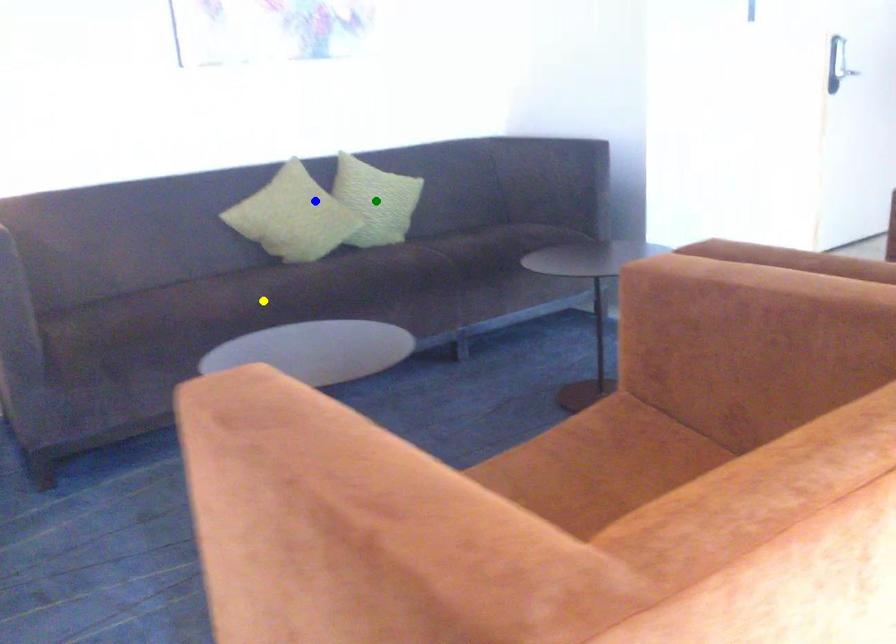
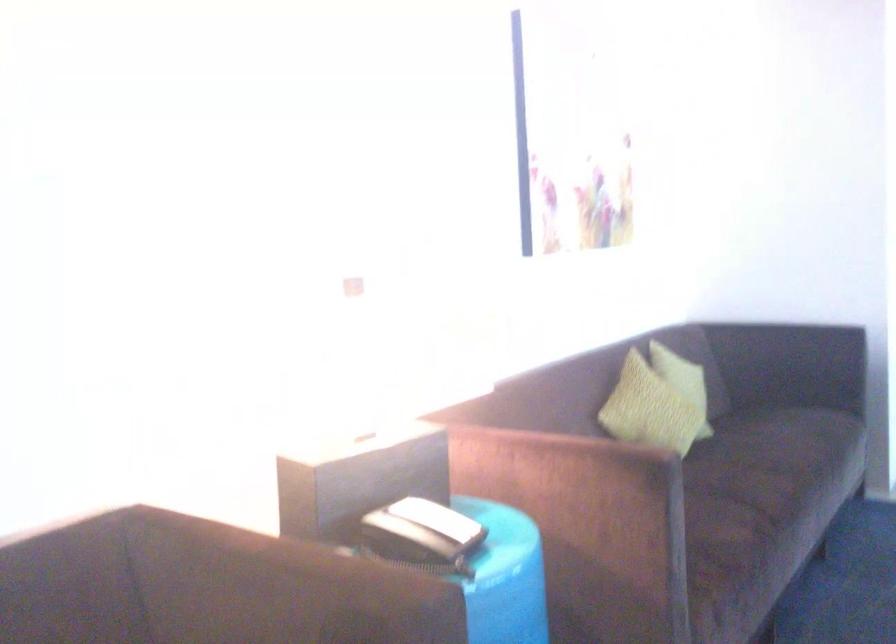
I am providing you with two images of the same scene from different viewpoints. Three points are marked in image1. Which point corresponds to a part or object that is occluded in image2?In image1, three points are marked. Which of them correspond to a part or object that is occluded in image2?Among the three points shown in image1, which one corresponds to a part or object that is no longer visible due to occlusion in image2?

green point cannot be seen in image2.